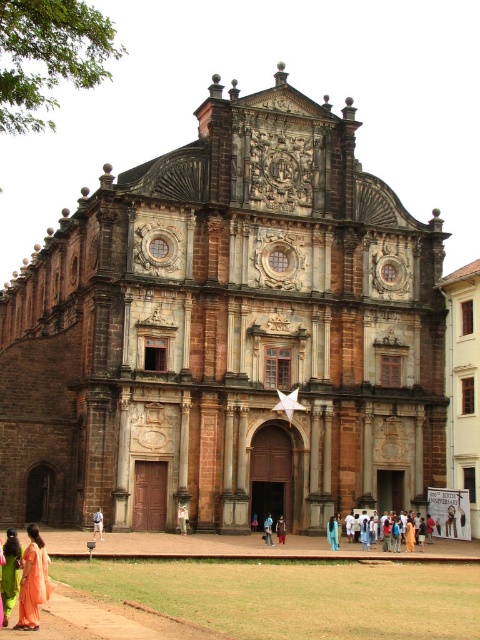
You are standing in front of the grand historical building and want to walk from point A to point B. Point A is at coordinate point [7,600] and point B is at coordinate point [180,531]. According to the image, which direction should you walk to reach point B from point A?

Since point [7,600] is in front of point [180,531], you should walk backward to reach point B from point A.

You are a photographer standing at the entrance of the grand historical building. You see an orange silk saree at lower left and a camera. Which object is closer to you?

The orange silk saree at lower left is closer to you since it is 38.56 meters away from the camera, meaning the saree is nearer than the camera.